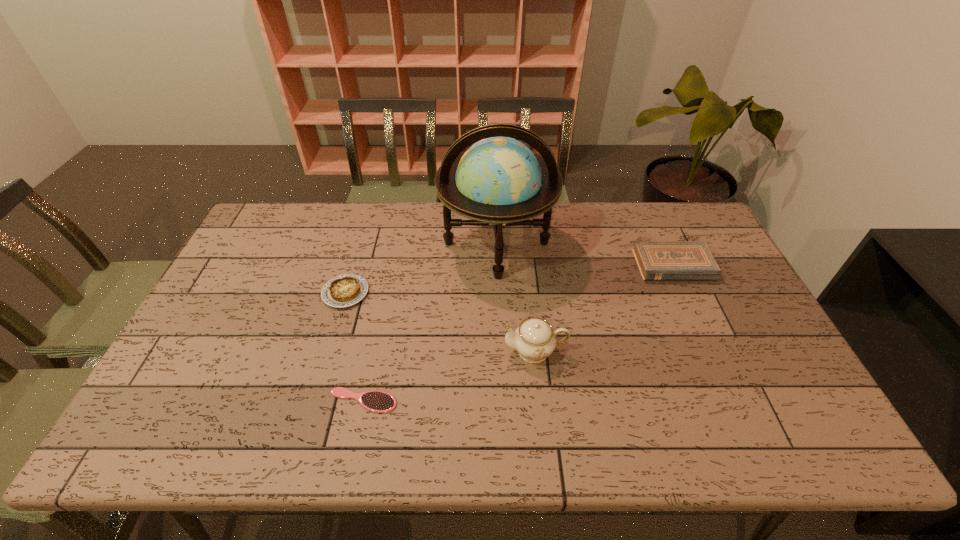
The width and height of the screenshot is (960, 540). In order to click on vacant space located 0.130m at the spout of the fourth farthest object in this screenshot , I will do `click(454, 350)`.

Identify the location of vacant space situated 0.180m at the spout of the fourth farthest object. (435, 350).

The height and width of the screenshot is (540, 960). I want to click on vacant space positioned 0.130m on the spine side of the rightmost object, so click(696, 315).

Identify the location of free spot located 0.110m on the front of the quiche. [x=331, y=341].

I want to click on free space located 0.170m on the right of the shortest object, so click(468, 401).

Locate an element on the screen. The image size is (960, 540). object at the far edge is located at coordinates (497, 182).

Locate an element on the screen. object positioned at the right edge is located at coordinates (657, 260).

Where is `free region at the far edge`? free region at the far edge is located at coordinates (441, 204).

At what (x,y) coordinates should I click in order to perform the action: click on free space at the left edge of the desktop. Please return your answer as a coordinate pair (x, y). The image size is (960, 540). Looking at the image, I should click on (206, 329).

Image resolution: width=960 pixels, height=540 pixels. Find the location of `vacant position at the right edge of the desktop`. vacant position at the right edge of the desktop is located at coordinates (766, 345).